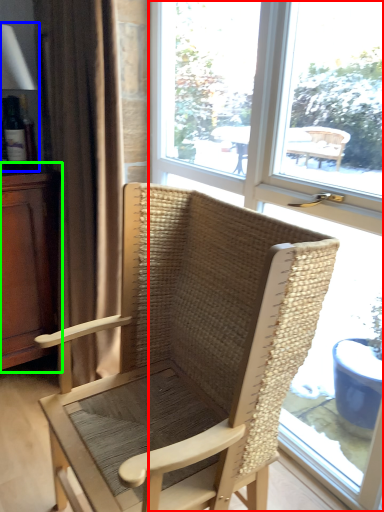
Question: Based on their relative distances, which object is farther from window (highlighted by a red box)? Choose from table lamp (highlighted by a blue box) and dresser (highlighted by a green box).

Choices:
 (A) table lamp
 (B) dresser

Answer: (A)